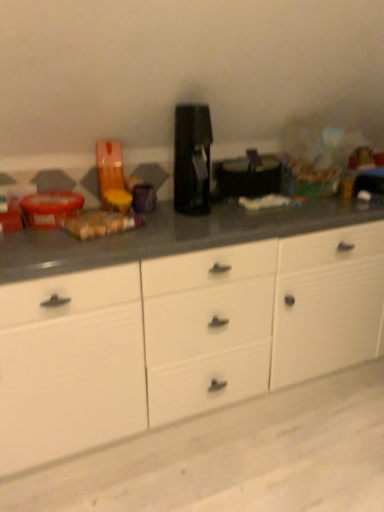
Question: In terms of size, does black plastic coffee machine at center appear bigger or smaller than white matte cabinet at center?

Choices:
 (A) big
 (B) small

Answer: (B)

Question: Considering their positions, is black plastic coffee machine at center located in front of or behind white matte cabinet at center?

Choices:
 (A) front
 (B) behind

Answer: (B)

Question: Is black plastic coffee machine at center inside the boundaries of white matte cabinet at center, or outside?

Choices:
 (A) outside
 (B) inside

Answer: (A)

Question: In terms of size, does white matte cabinet at center appear bigger or smaller than black plastic coffee machine at center?

Choices:
 (A) big
 (B) small

Answer: (A)

Question: In the image, is white matte cabinet at center positioned in front of or behind black plastic coffee machine at center?

Choices:
 (A) behind
 (B) front

Answer: (B)

Question: From the image's perspective, is white matte cabinet at center above or below black plastic coffee machine at center?

Choices:
 (A) above
 (B) below

Answer: (B)

Question: From a real-world perspective, relative to black plastic coffee machine at center, is white matte cabinet at center vertically above or below?

Choices:
 (A) below
 (B) above

Answer: (A)